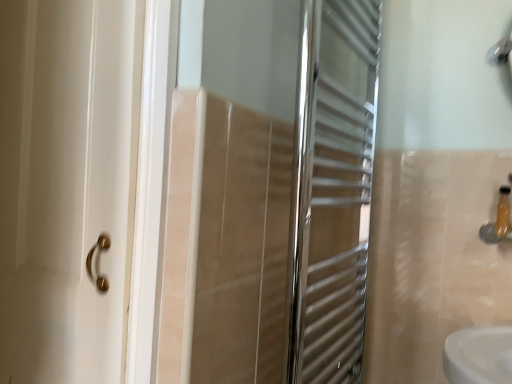
Question: Visually, is translucent plastic bottle at right positioned to the left or to the right of polished chrome towel rack at center?

Choices:
 (A) right
 (B) left

Answer: (A)

Question: Is translucent plastic bottle at right situated inside polished chrome towel rack at center or outside?

Choices:
 (A) inside
 (B) outside

Answer: (B)

Question: In terms of size, does translucent plastic bottle at right appear bigger or smaller than polished chrome towel rack at center?

Choices:
 (A) small
 (B) big

Answer: (A)

Question: Is polished chrome towel rack at center spatially inside translucent plastic bottle at right, or outside of it?

Choices:
 (A) inside
 (B) outside

Answer: (B)

Question: Is point (297, 213) positioned closer to the camera than point (503, 201)?

Choices:
 (A) farther
 (B) closer

Answer: (B)

Question: In the image, is polished chrome towel rack at center positioned in front of or behind translucent plastic bottle at right?

Choices:
 (A) behind
 (B) front

Answer: (B)

Question: Considering the positions of polished chrome towel rack at center and translucent plastic bottle at right in the image, is polished chrome towel rack at center taller or shorter than translucent plastic bottle at right?

Choices:
 (A) tall
 (B) short

Answer: (A)